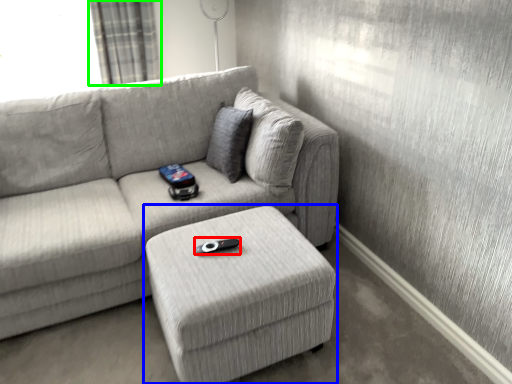
Question: Which is nearer to the remote (highlighted by a red box)? table (highlighted by a blue box) or curtain (highlighted by a green box).

Choices:
 (A) table
 (B) curtain

Answer: (A)